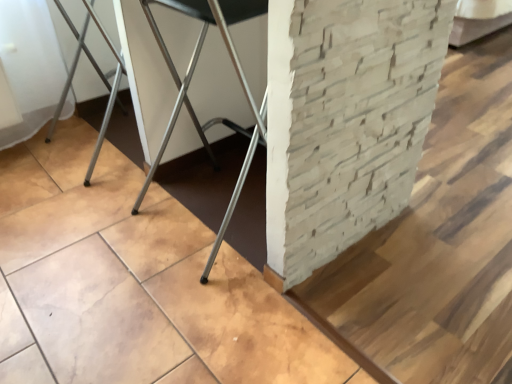
Question: Is metallic silver chair at center not inside light beige stone pillar at center?

Choices:
 (A) no
 (B) yes

Answer: (B)

Question: From a real-world perspective, is metallic silver chair at center on top of light beige stone pillar at center?

Choices:
 (A) no
 (B) yes

Answer: (B)

Question: Are metallic silver chair at center and light beige stone pillar at center far apart?

Choices:
 (A) no
 (B) yes

Answer: (A)

Question: From a real-world perspective, is metallic silver chair at center positioned under light beige stone pillar at center based on gravity?

Choices:
 (A) no
 (B) yes

Answer: (A)

Question: From the image's perspective, is metallic silver chair at center below light beige stone pillar at center?

Choices:
 (A) yes
 (B) no

Answer: (A)

Question: Is metallic silver chair at center further to camera compared to light beige stone pillar at center?

Choices:
 (A) yes
 (B) no

Answer: (A)

Question: Considering the relative sizes of light beige stone pillar at center and metallic silver chair at center in the image provided, is light beige stone pillar at center wider than metallic silver chair at center?

Choices:
 (A) no
 (B) yes

Answer: (B)

Question: From the image's perspective, would you say light beige stone pillar at center is positioned over metallic silver chair at center?

Choices:
 (A) no
 (B) yes

Answer: (B)

Question: From the image's perspective, is light beige stone pillar at center under metallic silver chair at center?

Choices:
 (A) yes
 (B) no

Answer: (B)

Question: Is light beige stone pillar at center looking in the opposite direction of metallic silver chair at center?

Choices:
 (A) yes
 (B) no

Answer: (A)

Question: Does light beige stone pillar at center come behind metallic silver chair at center?

Choices:
 (A) yes
 (B) no

Answer: (B)

Question: Considering the relative positions of light beige stone pillar at center and metallic silver chair at center in the image provided, is light beige stone pillar at center to the left of metallic silver chair at center from the viewer's perspective?

Choices:
 (A) no
 (B) yes

Answer: (A)

Question: Is light beige stone pillar at center wider or thinner than metallic silver chair at center?

Choices:
 (A) wide
 (B) thin

Answer: (A)